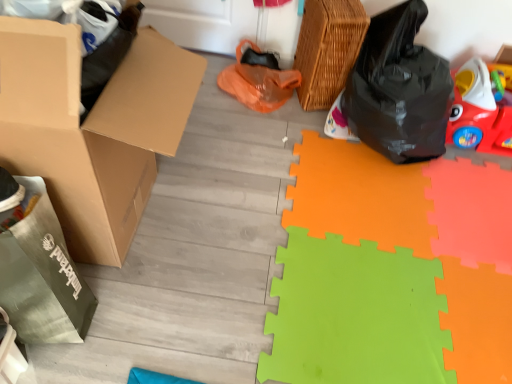
Locate an element on the screen. Image resolution: width=512 pixels, height=384 pixels. brown cardboard box at left is located at coordinates (92, 128).

At what (x,y) coordinates should I click in order to perform the action: click on green foam mat at lower right. Please return your answer as a coordinate pair (x, y). Looking at the image, I should click on (392, 271).

Locate an element on the screen. The height and width of the screenshot is (384, 512). woven brown basket at upper right is located at coordinates (328, 49).

Based on the photo, in terms of height, does woven brown basket at upper right look taller or shorter compared to rubberized red car at right?

woven brown basket at upper right is taller than rubberized red car at right.

From the image's perspective, is woven brown basket at upper right on rubberized red car at right?

Correct, woven brown basket at upper right appears higher than rubberized red car at right in the image.

Based on the photo, could you tell me if woven brown basket at upper right is turned towards rubberized red car at right?

No, woven brown basket at upper right is not oriented towards rubberized red car at right.

Looking at the image, does woven brown basket at upper right seem bigger or smaller compared to rubberized red car at right?

woven brown basket at upper right is smaller than rubberized red car at right.

Which is more to the left, black plastic bag at right or green foam mat at lower right?

green foam mat at lower right is more to the left.

Is point (392, 78) closer to viewer compared to point (432, 221)?

No.

Is black plastic bag at right not near green foam mat at lower right?

No, black plastic bag at right is not far from green foam mat at lower right.

Is green foam mat at lower right facing away from black plastic bag at right?

green foam mat at lower right is not turned away from black plastic bag at right.

Is green foam mat at lower right inside or outside of black plastic bag at right?

The correct answer is: outside.

Between green foam mat at lower right and black plastic bag at right, which one has smaller size?

Smaller between the two is green foam mat at lower right.

Can you confirm if green foam mat at lower right is shorter than black plastic bag at right?

Yes.

From the image's perspective, is brown cardboard box at left above or below green foam mat at lower right?

From the image's perspective, brown cardboard box at left appears above green foam mat at lower right.

Choose the correct answer: Is brown cardboard box at left inside green foam mat at lower right or outside it?

brown cardboard box at left lies outside green foam mat at lower right.

Where is `doormat to the right of brown cardboard box at left`? The image size is (512, 384). doormat to the right of brown cardboard box at left is located at coordinates pyautogui.click(x=392, y=271).

Is green foam mat at lower right at the back of brown cardboard box at left?

No.

Are woven brown basket at upper right and green foam mat at lower right located far from each other?

Actually, woven brown basket at upper right and green foam mat at lower right are a little close together.

Between woven brown basket at upper right and green foam mat at lower right, which one appears on the left side from the viewer's perspective?

From the viewer's perspective, woven brown basket at upper right appears more on the left side.

In terms of size, does woven brown basket at upper right appear bigger or smaller than green foam mat at lower right?

Considering their sizes, woven brown basket at upper right takes up less space than green foam mat at lower right.

Between woven brown basket at upper right and green foam mat at lower right, which one has less height?

green foam mat at lower right is shorter.

Consider the image. Is rubberized red car at right at the back of green foam mat at lower right?

No, green foam mat at lower right is not facing the opposite direction of rubberized red car at right.

Considering the sizes of objects green foam mat at lower right and rubberized red car at right in the image provided, who is taller, green foam mat at lower right or rubberized red car at right?

rubberized red car at right is taller.

Is green foam mat at lower right inside the boundaries of rubberized red car at right, or outside?

green foam mat at lower right lies outside rubberized red car at right.

Is brown cardboard box at left inside the boundaries of black plastic bag at right, or outside?

brown cardboard box at left is outside black plastic bag at right.

Considering the relative positions of brown cardboard box at left and black plastic bag at right in the image provided, is brown cardboard box at left to the left of black plastic bag at right from the viewer's perspective?

Yes, brown cardboard box at left is to the left of black plastic bag at right.

Find the location of `box located on the left of black plastic bag at right`. box located on the left of black plastic bag at right is located at coordinates (92, 128).

Is brown cardboard box at left oriented away from black plastic bag at right?

brown cardboard box at left is not turned away from black plastic bag at right.

At what (x,y) coordinates should I click in order to perform the action: click on basket that appears above the rubberized red car at right (from a real-world perspective). Please return your answer as a coordinate pair (x, y). This screenshot has height=384, width=512. Looking at the image, I should click on (328, 49).

Locate an element on the screen. doormat in front of the black plastic bag at right is located at coordinates (392, 271).

When comparing their distances from green foam mat at lower right, does rubberized red car at right or woven brown basket at upper right seem further?

Based on the image, woven brown basket at upper right appears to be further to green foam mat at lower right.

Considering their positions, is brown cardboard box at left positioned closer to woven brown basket at upper right than black plastic bag at right?

Among the two, black plastic bag at right is located nearer to woven brown basket at upper right.

Estimate the real-world distances between objects in this image. Which object is further from brown cardboard box at left, rubberized red car at right or black plastic bag at right?

Based on the image, rubberized red car at right appears to be further to brown cardboard box at left.

When comparing their distances from black plastic bag at right, does brown cardboard box at left or woven brown basket at upper right seem closer?

woven brown basket at upper right is positioned closer to the anchor black plastic bag at right.

Considering their positions, is black plastic bag at right positioned further to woven brown basket at upper right than brown cardboard box at left?

brown cardboard box at left is positioned further to the anchor woven brown basket at upper right.

From the image, which object appears to be nearer to green foam mat at lower right, brown cardboard box at left or woven brown basket at upper right?

woven brown basket at upper right is closer to green foam mat at lower right.

From the image, which object appears to be nearer to rubberized red car at right, brown cardboard box at left or green foam mat at lower right?

Among the two, green foam mat at lower right is located nearer to rubberized red car at right.

Looking at the image, which one is located closer to brown cardboard box at left, woven brown basket at upper right or green foam mat at lower right?

green foam mat at lower right lies closer to brown cardboard box at left than the other object.

What are the coordinates of `basket between brown cardboard box at left and green foam mat at lower right in the horizontal direction` in the screenshot? It's located at (328, 49).

Where is `toy between woven brown basket at upper right and green foam mat at lower right in the up-down direction`? This screenshot has width=512, height=384. toy between woven brown basket at upper right and green foam mat at lower right in the up-down direction is located at coordinates click(x=478, y=112).

I want to click on toy between black plastic bag at right and green foam mat at lower right from top to bottom, so click(x=478, y=112).

You are a GUI agent. You are given a task and a screenshot of the screen. Output one action in this format:
    pyautogui.click(x=<x>, y=<y>)
    Task: Click on the plastic bag between brown cardboard box at left and rubberized red car at right in the horizontal direction
    
    Given the screenshot: What is the action you would take?
    pyautogui.click(x=399, y=89)